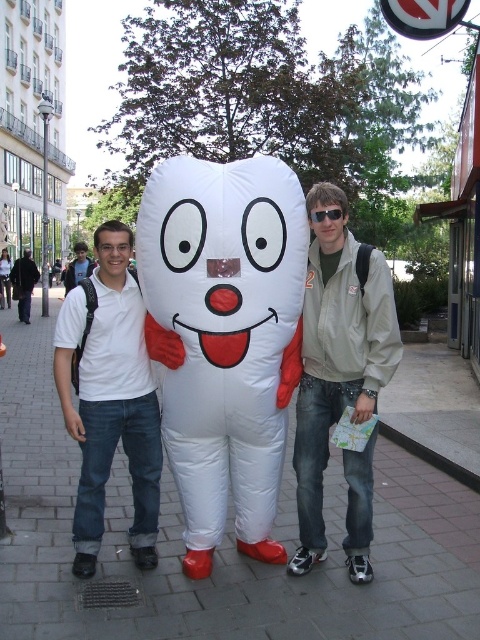
Question: Is white matte/inflatable at center below brushed metal backpack at left?

Choices:
 (A) no
 (B) yes

Answer: (B)

Question: Which object is closer to the camera taking this photo?

Choices:
 (A) white matte shirt at center
 (B) brushed metal backpack at left

Answer: (A)

Question: Can you confirm if white matte/inflatable at center is positioned to the right of brushed metal backpack at left?

Choices:
 (A) yes
 (B) no

Answer: (A)

Question: In this image, where is white brick pavement at center located relative to white matte shirt at center?

Choices:
 (A) below
 (B) above

Answer: (A)

Question: Among these points, which one is nearest to the camera?

Choices:
 (A) (108, 560)
 (B) (140, 268)
 (C) (78, 252)

Answer: (B)

Question: Which object is the closest to the white matte shirt at left?

Choices:
 (A) brushed metal backpack at left
 (B) matte gray jacket at center

Answer: (B)